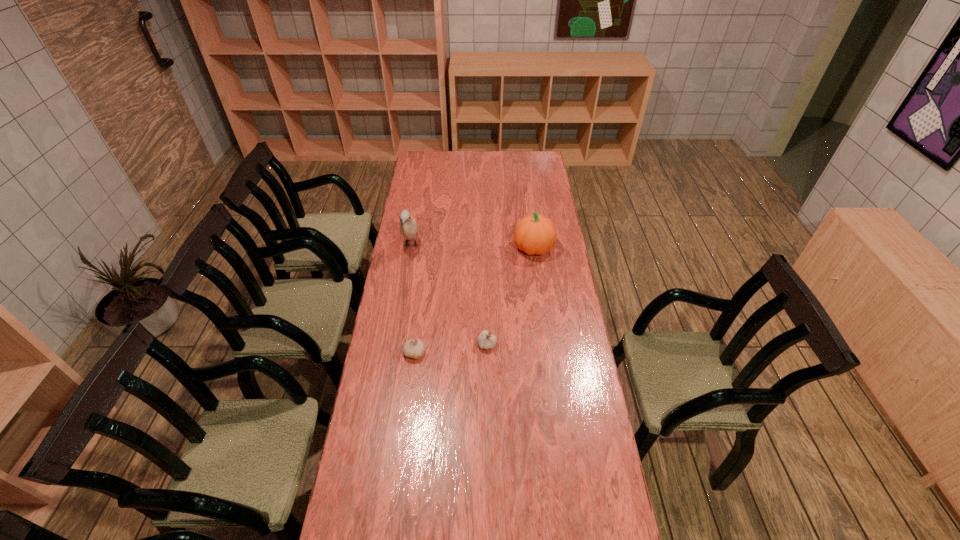
At what (x,y) coordinates should I click in order to perform the action: click on vacant area that lies between the third tallest object and the bird. Please return your answer as a coordinate pair (x, y). Looking at the image, I should click on (449, 295).

Where is `vacant region between the bird and the pumpkin`? The height and width of the screenshot is (540, 960). vacant region between the bird and the pumpkin is located at coordinates pyautogui.click(x=472, y=247).

I want to click on free space between the shorter garlic and the second object from right to left, so click(x=450, y=348).

Choose which object is the second nearest neighbor to the left garlic. Please provide its 2D coordinates. Your answer should be formatted as a tuple, i.e. [(x, y)], where the tuple contains the x and y coordinates of a point satisfying the conditions above.

[(408, 227)]

Identify which object is the third nearest to the second object from left to right. Please provide its 2D coordinates. Your answer should be formatted as a tuple, i.e. [(x, y)], where the tuple contains the x and y coordinates of a point satisfying the conditions above.

[(535, 234)]

Image resolution: width=960 pixels, height=540 pixels. What are the coordinates of `free space that satisfies the following two spatial constraints: 1. at the beak of the bird; 2. on the right side of the rightmost object` in the screenshot? It's located at (411, 248).

Identify the location of vacant region that satisfies the following two spatial constraints: 1. at the beak of the rightmost object; 2. on the right side of the bird. (411, 248).

Locate an element on the screen. Image resolution: width=960 pixels, height=540 pixels. vacant region that satisfies the following two spatial constraints: 1. at the beak of the leftmost object; 2. on the right side of the second object from left to right is located at coordinates (394, 353).